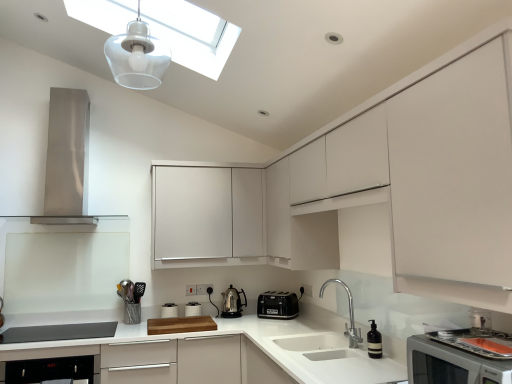
Question: From the image's perspective, is black glossy dishwasher at lower left below metallic silver utensil holder at lower left?

Choices:
 (A) no
 (B) yes

Answer: (B)

Question: Does black glossy dishwasher at lower left have a lesser width compared to metallic silver utensil holder at lower left?

Choices:
 (A) yes
 (B) no

Answer: (B)

Question: Is black glossy dishwasher at lower left smaller than metallic silver utensil holder at lower left?

Choices:
 (A) yes
 (B) no

Answer: (B)

Question: Is black glossy dishwasher at lower left oriented away from metallic silver utensil holder at lower left?

Choices:
 (A) no
 (B) yes

Answer: (A)

Question: From the image's perspective, does black glossy dishwasher at lower left appear higher than metallic silver utensil holder at lower left?

Choices:
 (A) no
 (B) yes

Answer: (A)

Question: In the image, is metallic silver utensil holder at lower left on the left side or the right side of transparent glass skylight at upper center?

Choices:
 (A) left
 (B) right

Answer: (A)

Question: Is metallic silver utensil holder at lower left situated inside transparent glass skylight at upper center or outside?

Choices:
 (A) outside
 (B) inside

Answer: (A)

Question: Considering the positions of metallic silver utensil holder at lower left and transparent glass skylight at upper center in the image, is metallic silver utensil holder at lower left taller or shorter than transparent glass skylight at upper center?

Choices:
 (A) tall
 (B) short

Answer: (A)

Question: Relative to transparent glass skylight at upper center, is metallic silver utensil holder at lower left in front or behind?

Choices:
 (A) behind
 (B) front

Answer: (A)

Question: In terms of height, does matte gray soundbar at lower left, which is the 3th home appliance from top to bottom, look taller or shorter compared to transparent glass skylight at upper center?

Choices:
 (A) tall
 (B) short

Answer: (B)

Question: Is matte gray soundbar at lower left, which is the 3th home appliance from top to bottom, inside the boundaries of transparent glass skylight at upper center, or outside?

Choices:
 (A) inside
 (B) outside

Answer: (B)

Question: In terms of size, does matte gray soundbar at lower left, which is the 2th home appliance in back-to-front order, appear bigger or smaller than transparent glass skylight at upper center?

Choices:
 (A) small
 (B) big

Answer: (A)

Question: Considering the positions of matte gray soundbar at lower left, placed as the 2th home appliance when sorted from right to left, and transparent glass skylight at upper center in the image, is matte gray soundbar at lower left, placed as the 2th home appliance when sorted from right to left, wider or thinner than transparent glass skylight at upper center?

Choices:
 (A) wide
 (B) thin

Answer: (B)

Question: Is white matte countertop at center in front of or behind white matte cabinet at center, marked as the 1th cabinetry in a front-to-back arrangement, in the image?

Choices:
 (A) behind
 (B) front

Answer: (A)

Question: From the image's perspective, is white matte countertop at center positioned above or below white matte cabinet at center, marked as the 1th cabinetry in a front-to-back arrangement?

Choices:
 (A) above
 (B) below

Answer: (B)